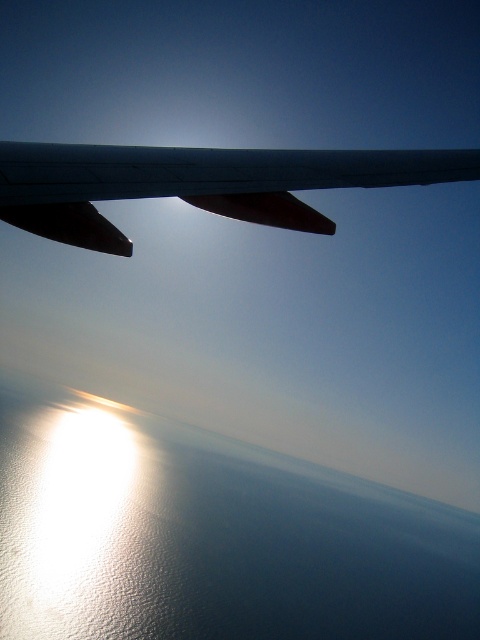
Does glistening blue water at bottom left have a greater width compared to metallic gray wing at upper center?

Yes, glistening blue water at bottom left is wider than metallic gray wing at upper center.

Is glistening blue water at bottom left thinner than metallic gray wing at upper center?

Incorrect, glistening blue water at bottom left's width is not less than metallic gray wing at upper center's.

Is point (283, 477) positioned after point (11, 188)?

Yes.

Identify the location of glistening blue water at bottom left. The width and height of the screenshot is (480, 640). (210, 536).